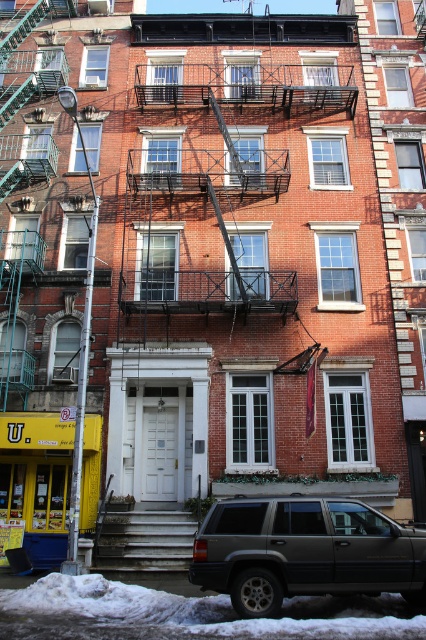
Does point (256, 609) lie behind point (175, 518)?

That is False.

This screenshot has height=640, width=426. What do you see at coordinates (304, 552) in the screenshot?
I see `dark gray matte suv at lower right` at bounding box center [304, 552].

Is point (275, 580) closer to viewer compared to point (126, 564)?

Yes.

Locate an element on the screen. dark gray matte suv at lower right is located at coordinates (304, 552).